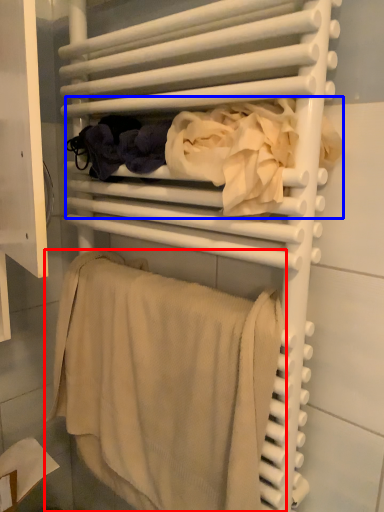
Question: Which point is closer to the camera, towel (highlighted by a red box) or clothing (highlighted by a blue box)?

Choices:
 (A) towel
 (B) clothing

Answer: (B)